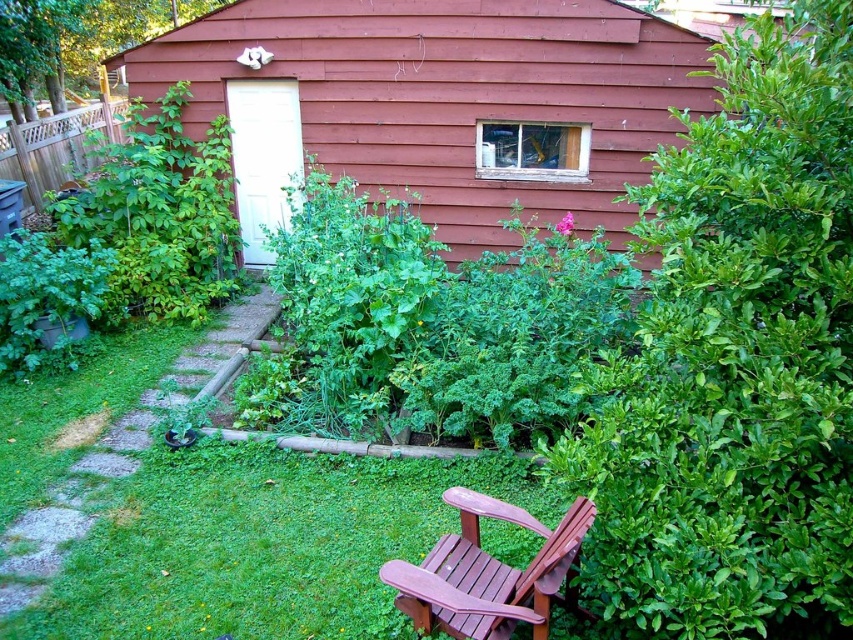
Question: Which object appears closest to the camera in this image?

Choices:
 (A) wooden shed at center
 (B) green leafy hedge at right
 (C) green leafy bush at left
 (D) mahogany wood chair at lower center

Answer: (B)

Question: Is green leafy hedge at right thinner than mahogany wood chair at lower center?

Choices:
 (A) yes
 (B) no

Answer: (B)

Question: Which object is the farthest from the wooden shed at center?

Choices:
 (A) green leafy hedge at right
 (B) mahogany wood chair at lower center
 (C) green leafy bush at left

Answer: (B)

Question: Does green leafy hedge at right have a larger size compared to green leafy bush at left?

Choices:
 (A) no
 (B) yes

Answer: (A)

Question: Which object is farther from the camera taking this photo?

Choices:
 (A) wooden shed at center
 (B) green leafy bush at left
 (C) mahogany wood chair at lower center
 (D) green leafy hedge at right

Answer: (A)

Question: Is wooden shed at center wider than mahogany wood chair at lower center?

Choices:
 (A) yes
 (B) no

Answer: (A)